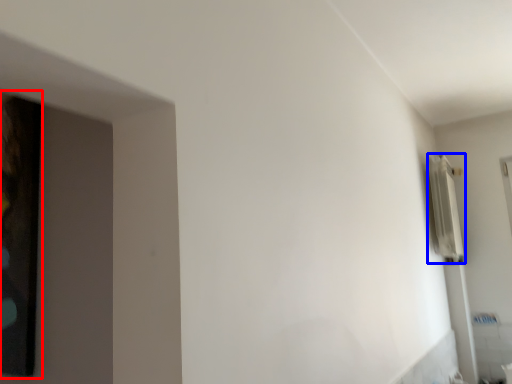
Question: Which object appears closest to the camera in this image, picture frame (highlighted by a red box) or radiator (highlighted by a blue box)?

Choices:
 (A) picture frame
 (B) radiator

Answer: (A)